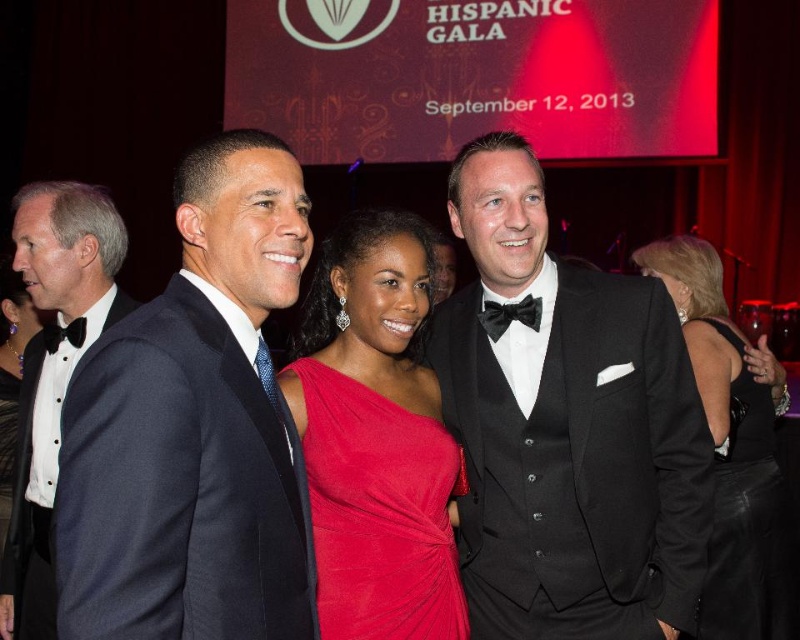
Question: Which of the following is the farthest from the observer?

Choices:
 (A) (729, 625)
 (B) (454, 467)
 (C) (492, 332)

Answer: (A)

Question: Which object appears farthest from the camera in this image?

Choices:
 (A) satin red dress at center
 (B) matte black bow tie at left
 (C) velvet black dress at center
 (D) matte black tuxedo at left

Answer: (B)

Question: From the image, what is the correct spatial relationship of velvet black dress at center in relation to matte black bow tie at left?

Choices:
 (A) left
 (B) right

Answer: (B)

Question: Does velvet black dress at center appear over black satin bow tie at right?

Choices:
 (A) yes
 (B) no

Answer: (B)

Question: Can you confirm if satin red dress at center is positioned below matte black tuxedo at left?

Choices:
 (A) no
 (B) yes

Answer: (B)

Question: Which object appears closest to the camera in this image?

Choices:
 (A) matte black tuxedo at left
 (B) black satin tuxedo at center

Answer: (B)